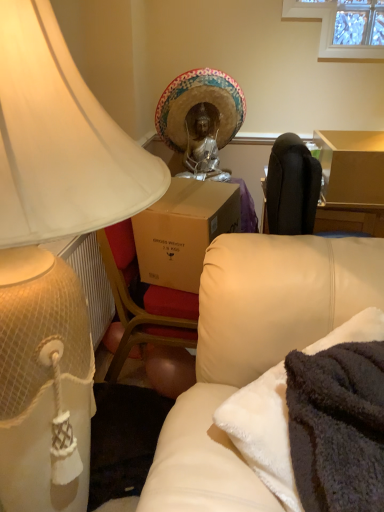
Question: From the image's perspective, is gold textured headdress at center located beneath matte white lampshade at left?

Choices:
 (A) no
 (B) yes

Answer: (A)

Question: Considering the relative sizes of gold textured headdress at center and matte white lampshade at left in the image provided, is gold textured headdress at center wider than matte white lampshade at left?

Choices:
 (A) no
 (B) yes

Answer: (A)

Question: Can you confirm if gold textured headdress at center is smaller than matte white lampshade at left?

Choices:
 (A) yes
 (B) no

Answer: (A)

Question: Is gold textured headdress at center surrounding matte white lampshade at left?

Choices:
 (A) yes
 (B) no

Answer: (B)

Question: Is gold textured headdress at center positioned before matte white lampshade at left?

Choices:
 (A) no
 (B) yes

Answer: (A)

Question: Is gold textured headdress at center outside matte white lampshade at left?

Choices:
 (A) yes
 (B) no

Answer: (A)

Question: From a real-world perspective, is gold textured headdress at center physically above soft cream leather couch at lower right?

Choices:
 (A) no
 (B) yes

Answer: (B)

Question: Can you confirm if gold textured headdress at center is bigger than soft cream leather couch at lower right?

Choices:
 (A) no
 (B) yes

Answer: (B)

Question: Does gold textured headdress at center have a lesser width compared to soft cream leather couch at lower right?

Choices:
 (A) no
 (B) yes

Answer: (B)

Question: Is gold textured headdress at center wider than soft cream leather couch at lower right?

Choices:
 (A) no
 (B) yes

Answer: (A)

Question: Is gold textured headdress at center smaller than soft cream leather couch at lower right?

Choices:
 (A) yes
 (B) no

Answer: (B)

Question: Considering the relative sizes of gold textured headdress at center and soft cream leather couch at lower right in the image provided, is gold textured headdress at center taller than soft cream leather couch at lower right?

Choices:
 (A) no
 (B) yes

Answer: (B)

Question: Does soft cream leather couch at lower right have a greater width compared to matte white lampshade at left?

Choices:
 (A) yes
 (B) no

Answer: (B)